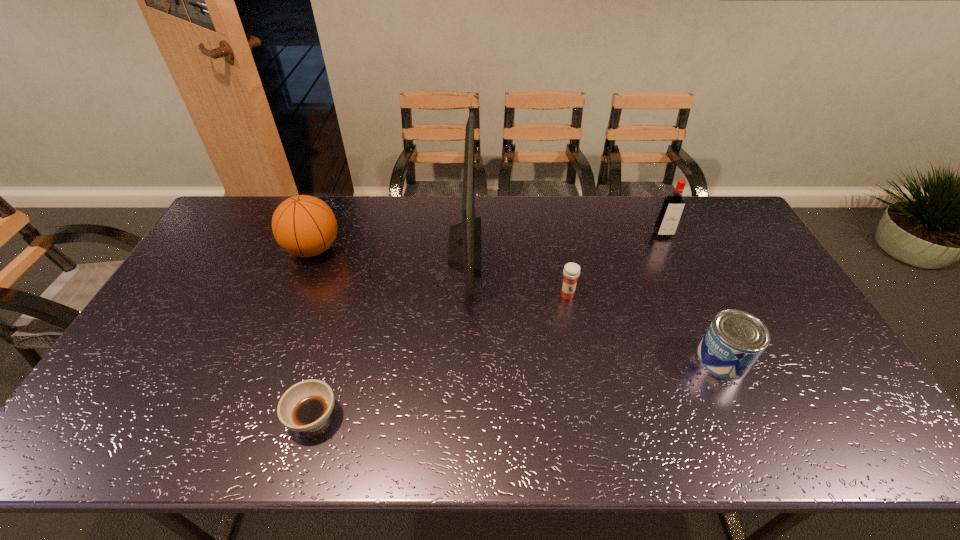
Where is `vacant region between the soup bowl and the fourth object from left to right`? The image size is (960, 540). vacant region between the soup bowl and the fourth object from left to right is located at coordinates (441, 357).

Locate an element on the screen. This screenshot has height=540, width=960. unoccupied position between the basketball and the can is located at coordinates (517, 304).

The image size is (960, 540). I want to click on free spot between the medicine and the monitor, so click(516, 271).

The width and height of the screenshot is (960, 540). What are the coordinates of `vacant area that lies between the monitor and the vodka` in the screenshot? It's located at (564, 240).

The image size is (960, 540). What are the coordinates of `vacant space in between the nearest object and the leftmost object` in the screenshot? It's located at (314, 334).

Locate an element on the screen. free space between the basketball and the vodka is located at coordinates (488, 242).

Select which object is the third closest to the tallest object. Please provide its 2D coordinates. Your answer should be formatted as a tuple, i.e. [(x, y)], where the tuple contains the x and y coordinates of a point satisfying the conditions above.

[(306, 406)]

Identify the location of the closest object to the fifth farthest object. (571, 271).

The height and width of the screenshot is (540, 960). What are the coordinates of `vacant point that satisfies the following two spatial constraints: 1. on the screen side of the monitor; 2. on the front side of the leftmost object` in the screenshot? It's located at (465, 249).